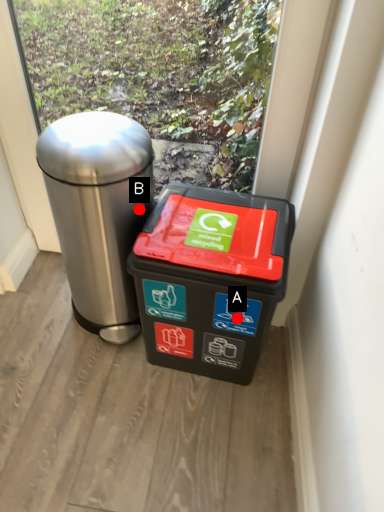
Question: Two points are circled on the image, labeled by A and B beside each circle. Which point appears farthest from the camera in this image?

Choices:
 (A) A is further
 (B) B is further

Answer: (B)